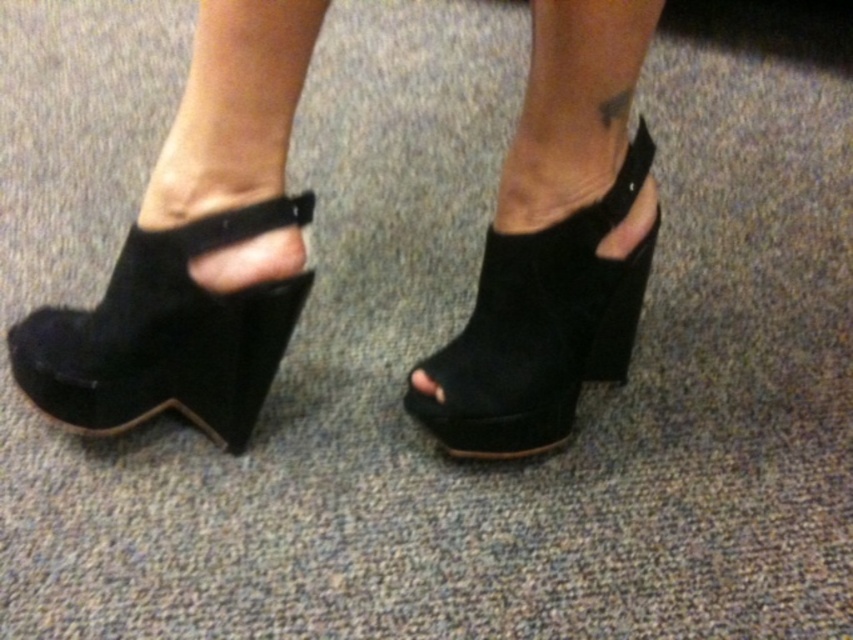
You are a photographer setting up a shoot focusing on footwear. You have two pairs of suede wedge shoes at center and suede black wedge at left. To ensure proper lighting, you need to know their positions. Which pair is positioned to the right side?

The suede wedge shoes at center is positioned to the right of the suede black wedge at left.

You are a photographer trying to capture a close up of the tattoo on the inner side of the leg near the ankle. The tattoo is located at point (238, 404). If your camera is currently positioned 93.09 centimeters away from the point, is this distance sufficient to get a clear, detailed shot of the tattoo?

A: The point (238, 404) is 93.09 centimeters away from the camera. This distance may be sufficient for a clear, detailed shot of the tattoo, depending on the camera lens and zoom capabilities. However, moving closer could enhance clarity if possible.